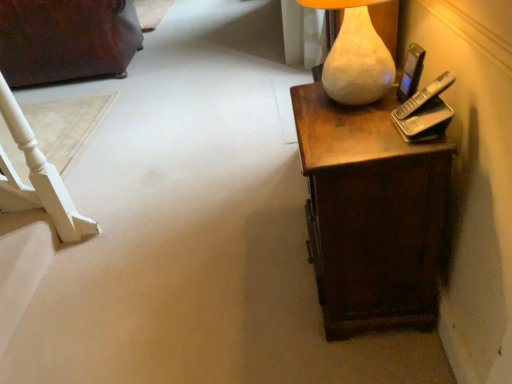
I want to click on free space in front of dark brown wood dresser at upper left, so click(104, 122).